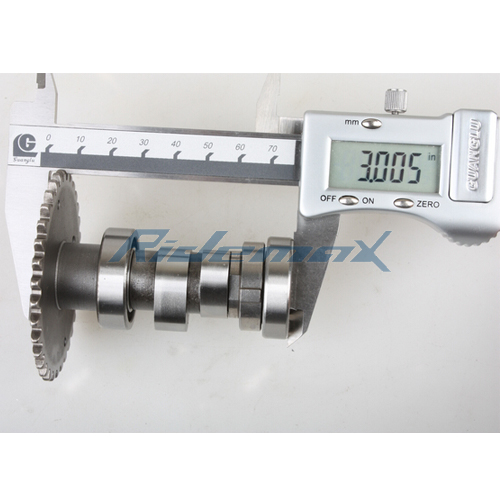
I want to click on on/off switch, so click(x=342, y=200).